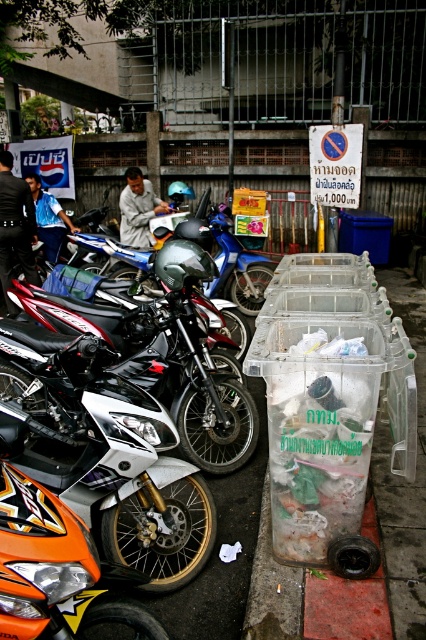
Question: Which object is farther from the camera taking this photo?

Choices:
 (A) shiny black motorcycle at center
 (B) light brown fabric shirt at center
 (C) dark blue shirt at left
 (D) white glossy motorcycle at center

Answer: (B)

Question: Does dark blue shirt at left appear under light brown fabric shirt at center?

Choices:
 (A) yes
 (B) no

Answer: (A)

Question: Which object appears farthest from the camera in this image?

Choices:
 (A) shiny black motorcycle at center
 (B) dark blue shirt at left

Answer: (B)

Question: Can you confirm if shiny black motorcycle at center is positioned to the left of dark blue shirt at left?

Choices:
 (A) no
 (B) yes

Answer: (A)

Question: Which point appears farthest from the camera in this image?

Choices:
 (A) (138, 259)
 (B) (155, 349)
 (C) (137, 179)
 (D) (2, 227)

Answer: (C)

Question: Is white glossy motorcycle at center bigger than light brown fabric shirt at center?

Choices:
 (A) no
 (B) yes

Answer: (B)